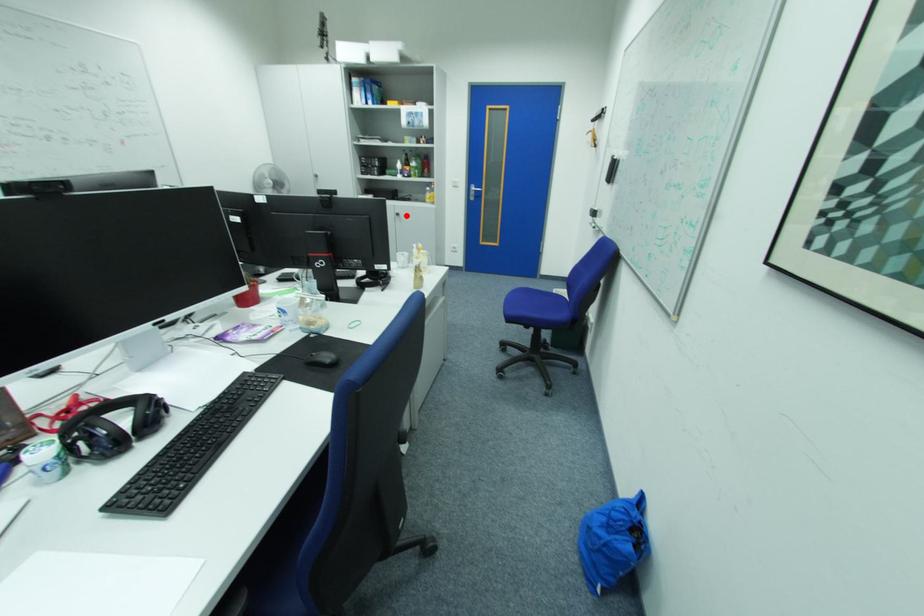
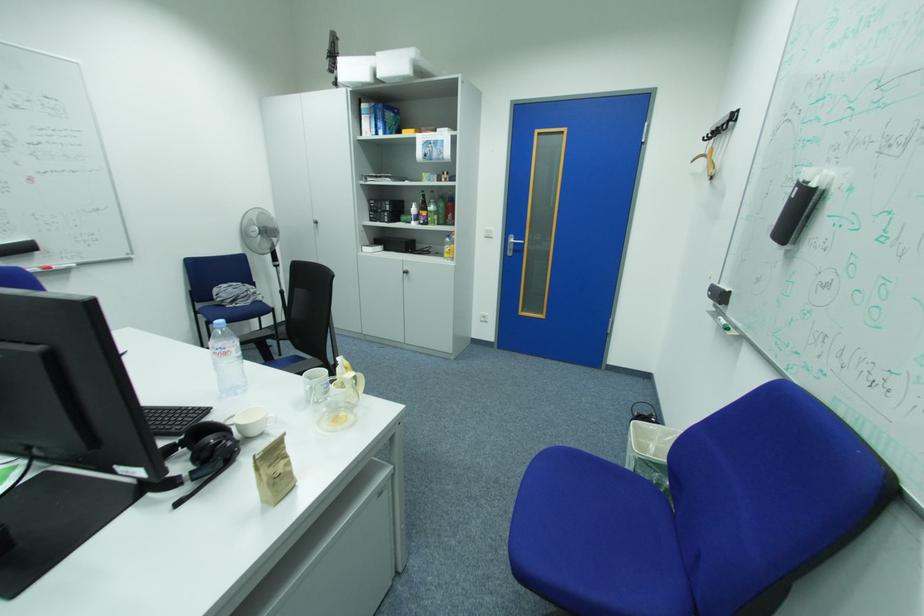
Question: A red point is marked in image1. In image2, is the corresponding 3D point closer to the camera or farther? Reply with the corresponding letter.

Choices:
 (A) The corresponding 3D point is closer.
 (B) The corresponding 3D point is farther.

Answer: (A)